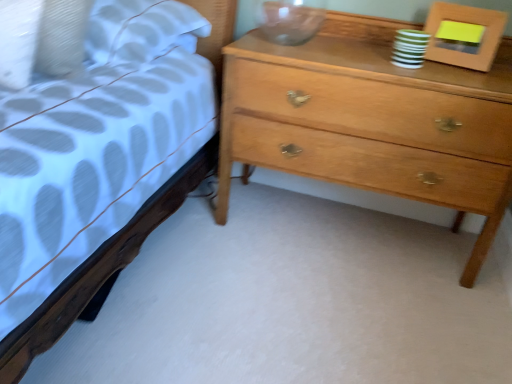
At what (x,y) coordinates should I click in order to perform the action: click on vacant area situated below light brown wood chest of drawers at right (from a real-world perspective). Please return your answer as a coordinate pair (x, y). This screenshot has width=512, height=384. Looking at the image, I should click on (342, 225).